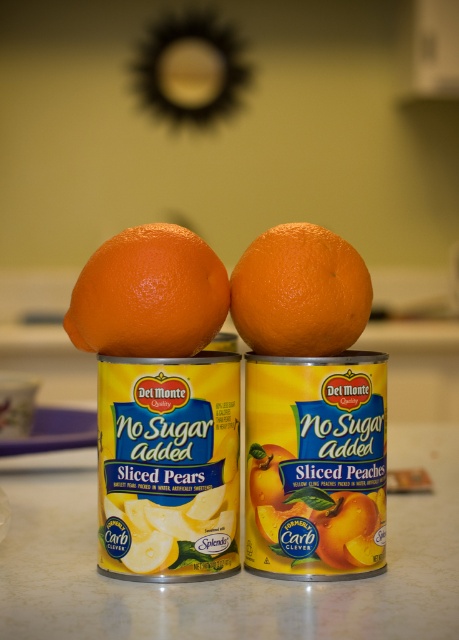
Does orangesmoothorange at left have a greater width compared to orangesmoothorange at right?

Indeed, orangesmoothorange at left has a greater width compared to orangesmoothorange at right.

Is orangesmoothorange at left further to camera compared to orangesmoothorange at right?

That is False.

Who is more forward, (113,252) or (297,252)?

Point (297,252)

Identify the location of orangesmoothorange at left. (149, 294).